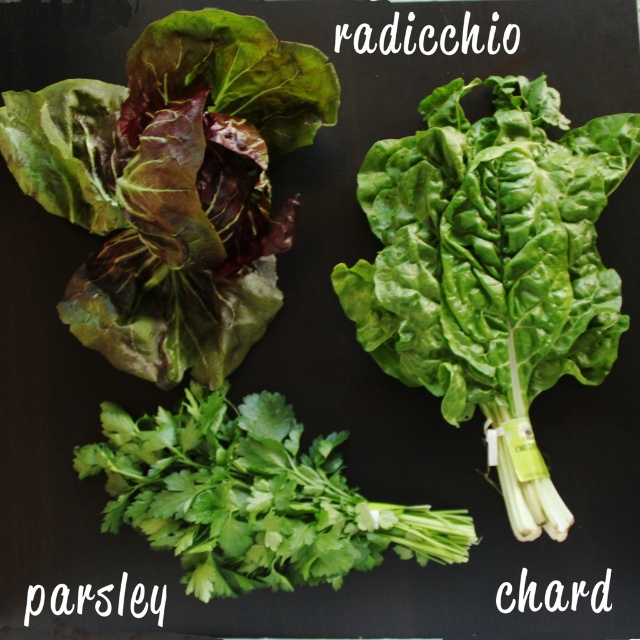
You are arranging a salad and see the green leafy chard at center and the green leafy parsley at lower center in the image. Which one is positioned higher up?

The green leafy chard at center is located above the green leafy parsley at lower center, so it is positioned higher up.

Based on the scene description, where is the green leafy chard at center located in terms of coordinates?

The green leafy chard at center is located at coordinates point (492, 268).

You are a chef preparing a garnish for a plate. You need to choose between the dark green leafy at upper left and the green leafy parsley at lower center. Which one would you select if you want a larger garnish?

The dark green leafy at upper left has a larger size compared to the green leafy parsley at lower center, so it would be the better choice for a larger garnish.